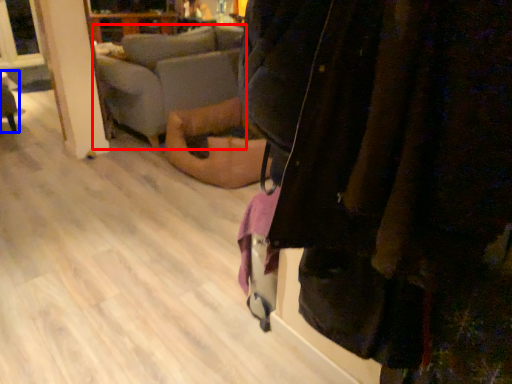
Question: Which object appears closest to the camera in this image, studio couch (highlighted by a red box) or furniture (highlighted by a blue box)?

Choices:
 (A) studio couch
 (B) furniture

Answer: (A)